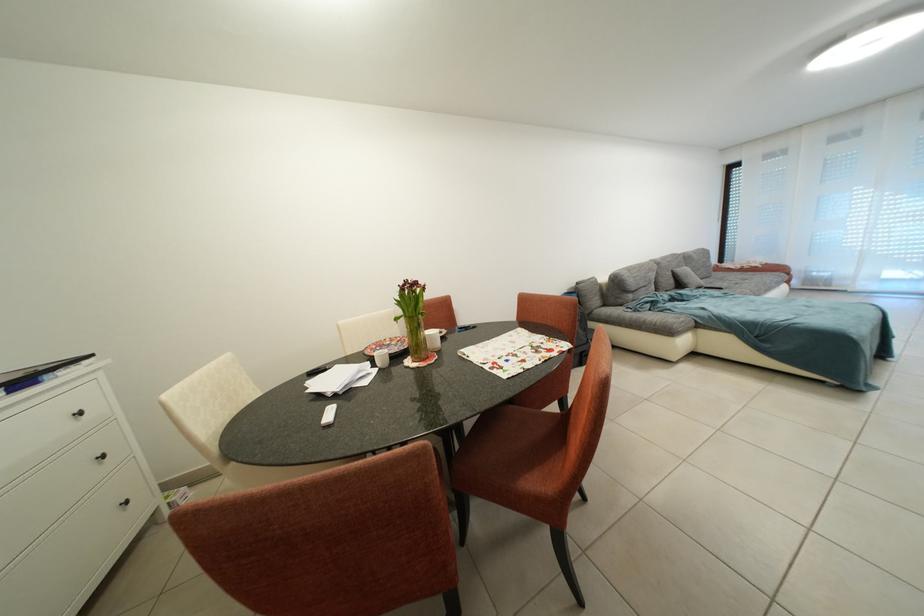
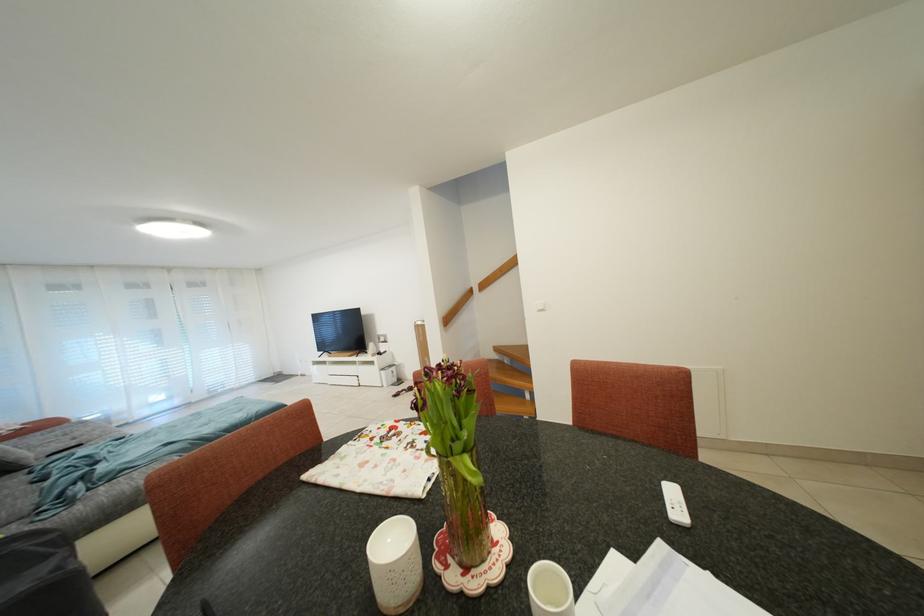
Find the pixel in the second image that matches pixel 695 285 in the first image.

(19, 462)